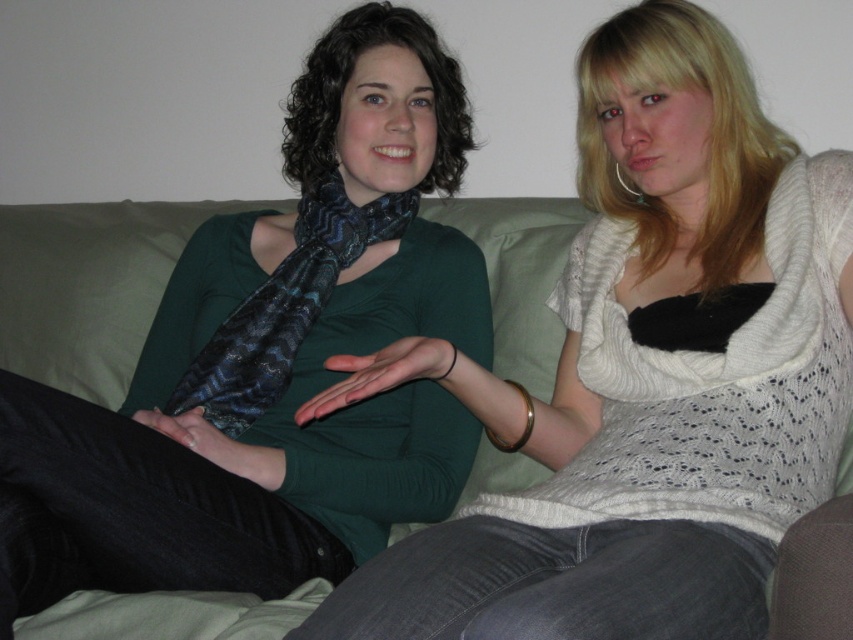
Question: Which object is closer to the camera taking this photo?

Choices:
 (A) shiny blue silk scarf at center
 (B) green fabric couch at center

Answer: (A)

Question: In this image, where is matte black scarf at center located relative to shiny blue silk scarf at center?

Choices:
 (A) left
 (B) right

Answer: (B)

Question: Is matte black scarf at center smaller than green fabric couch at center?

Choices:
 (A) no
 (B) yes

Answer: (A)

Question: Which is nearer to the green fabric couch at center?

Choices:
 (A) matte black scarf at center
 (B) shiny blue silk scarf at center

Answer: (B)

Question: Considering the relative positions of matte black scarf at center and shiny blue silk scarf at center in the image provided, where is matte black scarf at center located with respect to shiny blue silk scarf at center?

Choices:
 (A) below
 (B) above

Answer: (A)

Question: Which point is farther from the camera taking this photo?

Choices:
 (A) (128, 566)
 (B) (194, 364)

Answer: (B)